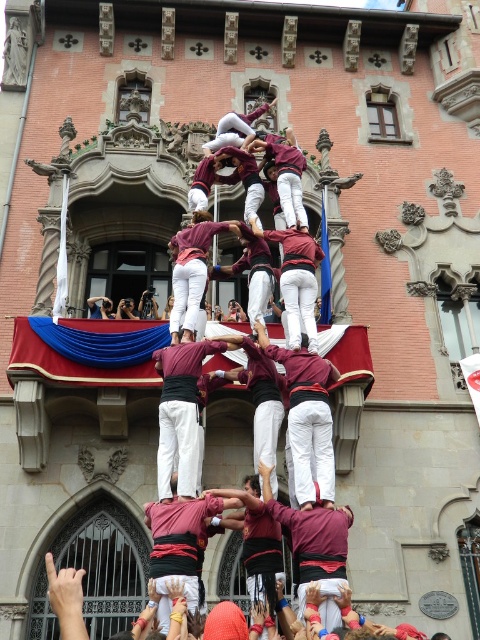
Between maroon fabric at center and maroon fabric man at center, which one has less height?

maroon fabric man at center is shorter.

Between maroon fabric at center and maroon fabric man at center, which one has more height?

maroon fabric at center

In order to click on maroon fabric at center in this screenshot , I will do `click(314, 548)`.